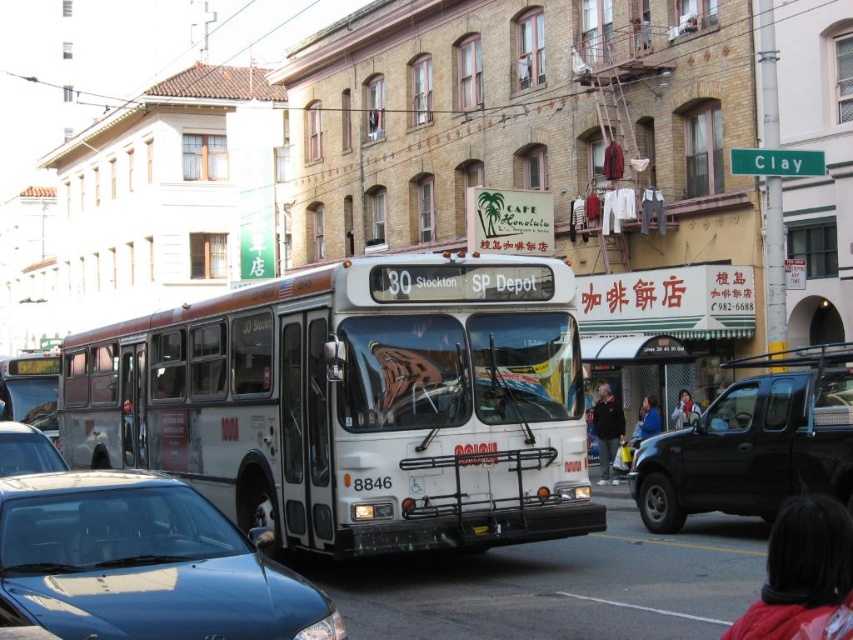
You are standing at the bus stop waiting for the bus. You see a point marked at coordinates (x=683, y=410). What object is located at that point?

The matte black jacket at center is located at point (x=683, y=410).

From the picture: You are standing on the sidewalk and want to cross the street to reach the white matte bus at center. The crosswalk is 25 feet away from you. Can you safely cross the street before the bus moves forward?

The white matte bus at center is 30.82 feet away from the viewer. Since the crosswalk is only 25 feet away, you can safely cross the street before the bus reaches the crosswalk.

You are a delivery person needing to place a small package between the matte black jacket at center and the black plastic license plate at center. Which object should you place the package next to to ensure it fits without overlapping?

The matte black jacket at center has a larger width than the black plastic license plate at center, so placing the package next to the black plastic license plate at center would ensure it fits without overlapping.